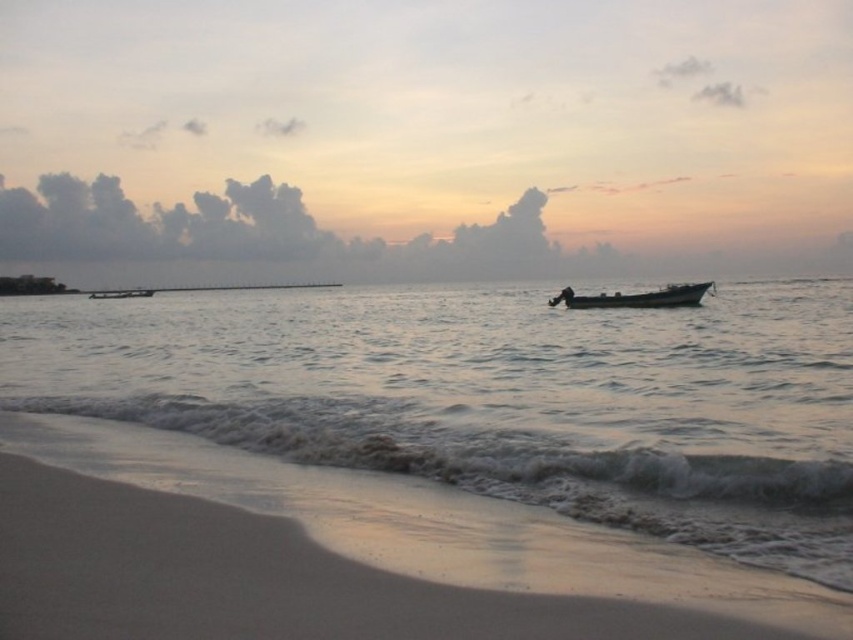
Can you confirm if smooth water at center is shorter than metallic silver boat at center?

No, smooth water at center is not shorter than metallic silver boat at center.

Can you confirm if smooth water at center is positioned to the left of metallic silver boat at center?

Incorrect, smooth water at center is not on the left side of metallic silver boat at center.

The width and height of the screenshot is (853, 640). I want to click on smooth water at center, so click(496, 397).

This screenshot has height=640, width=853. Identify the location of smooth water at center. (496, 397).

Is smooth sand at lower left thinner than dark gray metallic boat at center?

Correct, smooth sand at lower left's width is less than dark gray metallic boat at center's.

From the picture: Between smooth sand at lower left and dark gray metallic boat at center, which one appears on the right side from the viewer's perspective?

dark gray metallic boat at center

Does point (375, 609) come farther from viewer compared to point (654, 296)?

No, (375, 609) is closer to viewer.

Image resolution: width=853 pixels, height=640 pixels. In order to click on smooth sand at lower left in this screenshot , I will do `click(260, 579)`.

Is smooth sand at lower left thinner than metallic silver boat at center?

Yes.

Does smooth sand at lower left come behind metallic silver boat at center?

No.

Between point (120, 550) and point (137, 292), which one is positioned in front?

Point (120, 550) is more forward.

Locate an element on the screen. The image size is (853, 640). smooth sand at lower left is located at coordinates (260, 579).